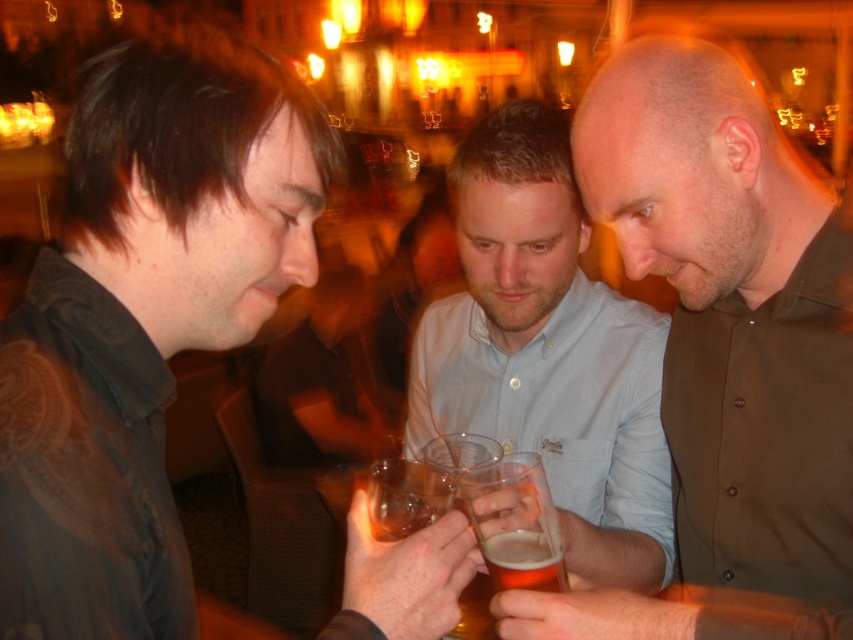
Is brown button-down shirt at center further to the viewer compared to smooth wooden table at center?

No, brown button-down shirt at center is in front of smooth wooden table at center.

Which is in front, point (560, 600) or point (344, 296)?

Point (560, 600)

Image resolution: width=853 pixels, height=640 pixels. In order to click on brown button-down shirt at center in this screenshot , I will do `click(724, 352)`.

From the picture: Is translucent glass mug at center closer to the viewer compared to translucent glass beer at center?

Yes, translucent glass mug at center is closer to the viewer.

Does point (461, 488) come behind point (519, 566)?

Yes, it is.

You are a GUI agent. You are given a task and a screenshot of the screen. Output one action in this format:
    pyautogui.click(x=<x>, y=<y>)
    Task: Click on the translucent glass mug at center
    The image size is (853, 640).
    Given the screenshot: What is the action you would take?
    pyautogui.click(x=515, y=522)

Is brown button-down shirt at center shorter than light blue shirt at center?

Correct, brown button-down shirt at center is not as tall as light blue shirt at center.

Which is below, brown button-down shirt at center or light blue shirt at center?

brown button-down shirt at center is below.

Locate an element on the screen. The height and width of the screenshot is (640, 853). brown button-down shirt at center is located at coordinates (724, 352).